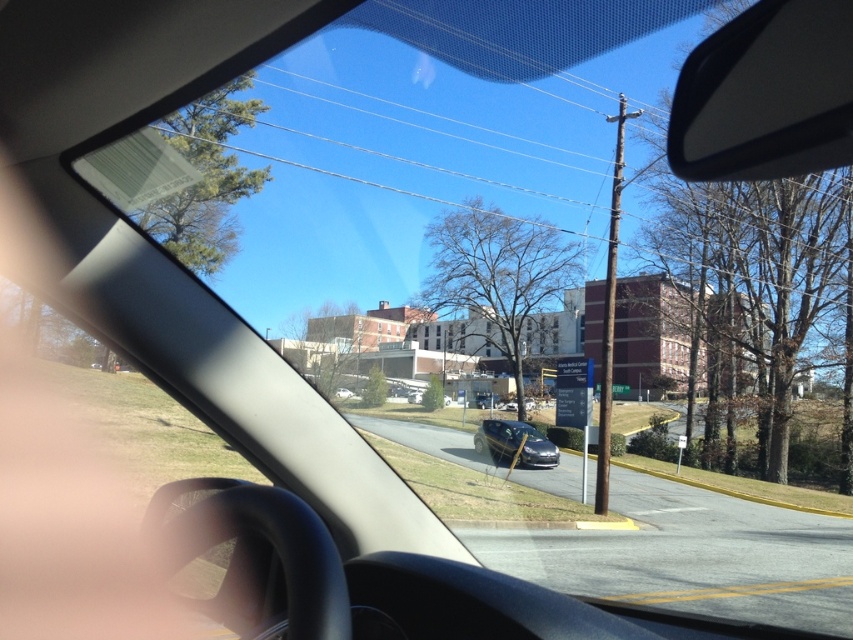
Question: Is black plastic view mirror at upper right wider than satin black sedan at center?

Choices:
 (A) no
 (B) yes

Answer: (A)

Question: Can you confirm if black plastic view mirror at upper right is positioned above satin black sedan at center?

Choices:
 (A) no
 (B) yes

Answer: (B)

Question: Does black plastic view mirror at upper right lie in front of satin black sedan at center?

Choices:
 (A) no
 (B) yes

Answer: (B)